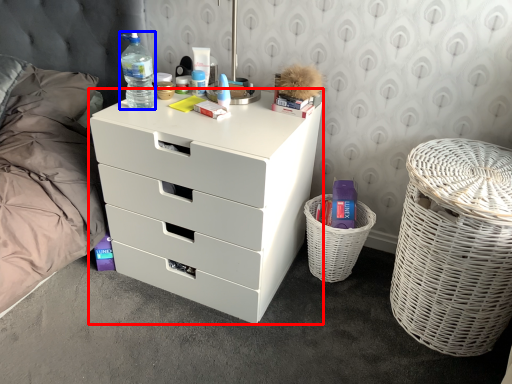
Question: Among these objects, which one is farthest to the camera, chest of drawers (highlighted by a red box) or bottle (highlighted by a blue box)?

Choices:
 (A) chest of drawers
 (B) bottle

Answer: (B)